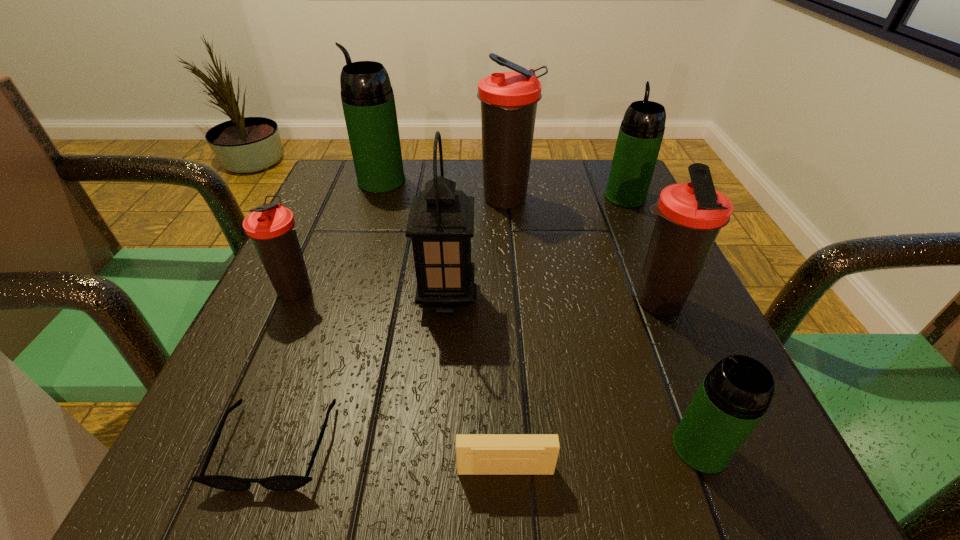
The image size is (960, 540). Identify the location of thermos bottle that can be found as the third closest to the black lantern. (690, 215).

Image resolution: width=960 pixels, height=540 pixels. What are the coordinates of `the closest brown thermos bottle to the lantern` in the screenshot? It's located at (271, 227).

This screenshot has width=960, height=540. In order to click on the closest brown thermos bottle to the beige videotape in this screenshot , I will do coord(690,215).

At what (x,y) coordinates should I click in order to perform the action: click on green thermos bottle that can be found as the second closest to the second smallest green thermos bottle. Please return your answer as a coordinate pair (x, y). Image resolution: width=960 pixels, height=540 pixels. Looking at the image, I should click on (734, 396).

Find the location of a particular element. The height and width of the screenshot is (540, 960). green thermos bottle that is the third closest to the black lantern is located at coordinates [641, 132].

Locate an element on the screen. free space that satisfies the following two spatial constraints: 1. on the back side of the lantern; 2. from the spout of the leftmost green thermos bottle is located at coordinates (456, 181).

At what (x,y) coordinates should I click in order to perform the action: click on free spot that satisfies the following two spatial constraints: 1. from the spout of the biggest green thermos bottle; 2. on the left side of the lantern. Please return your answer as a coordinate pair (x, y). This screenshot has width=960, height=540. Looking at the image, I should click on (344, 298).

Image resolution: width=960 pixels, height=540 pixels. What are the coordinates of `free location that satisfies the following two spatial constraints: 1. from the spout of the leftmost green thermos bottle; 2. on the front-facing side of the black sunglasses` in the screenshot? It's located at (296, 444).